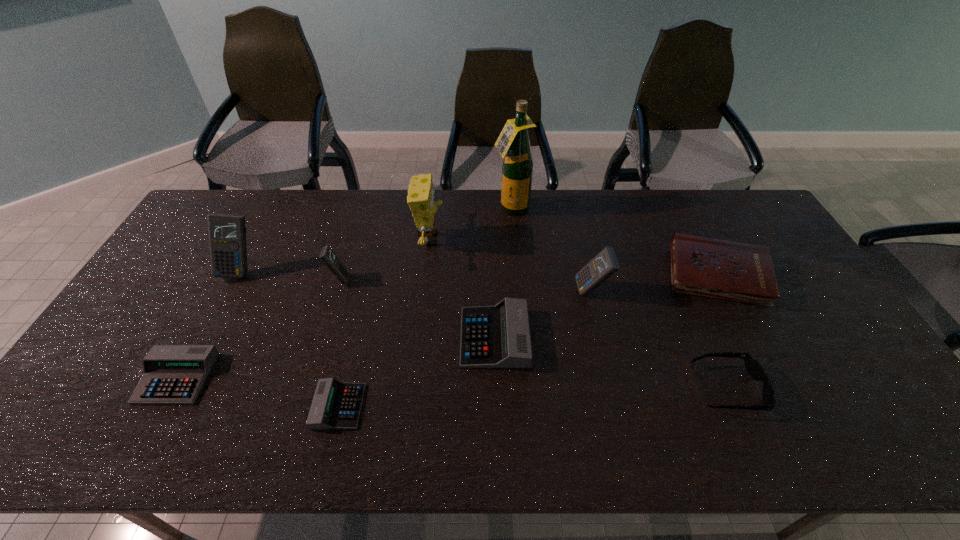
Identify the location of free spot located 0.250m on the right of the smallest gray calculator. The height and width of the screenshot is (540, 960). (467, 406).

The image size is (960, 540). Find the location of `liquor at the far edge`. liquor at the far edge is located at coordinates click(513, 142).

I want to click on sponge present at the far edge, so click(x=421, y=194).

At what (x,y) coordinates should I click in order to perform the action: click on sunglasses at the near edge. Please return your answer as a coordinate pair (x, y). The width and height of the screenshot is (960, 540). Looking at the image, I should click on (753, 367).

Identify the location of calculator at the near edge. This screenshot has height=540, width=960. (336, 405).

At what (x,y) coordinates should I click in order to perform the action: click on object at the left edge. Please return your answer as a coordinate pair (x, y). The height and width of the screenshot is (540, 960). Looking at the image, I should click on (172, 374).

This screenshot has width=960, height=540. Identify the location of object present at the right edge. (743, 272).

What are the coordinates of `free space at the far edge` in the screenshot? It's located at (316, 194).

In the image, there is a desktop. Identify the location of vacant space at the near edge. tap(297, 442).

In the image, there is a desktop. Identify the location of vacant region at the left edge. This screenshot has height=540, width=960. (178, 307).